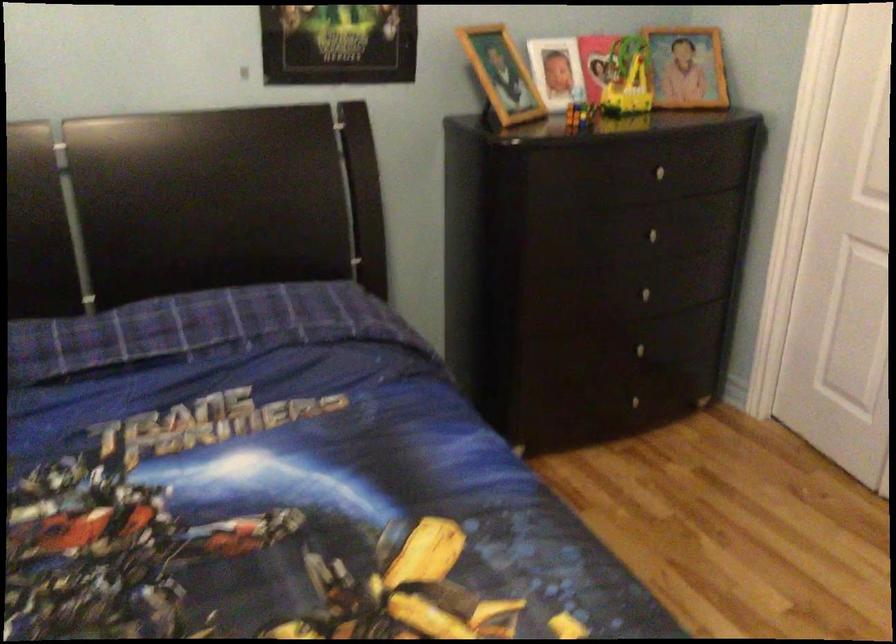
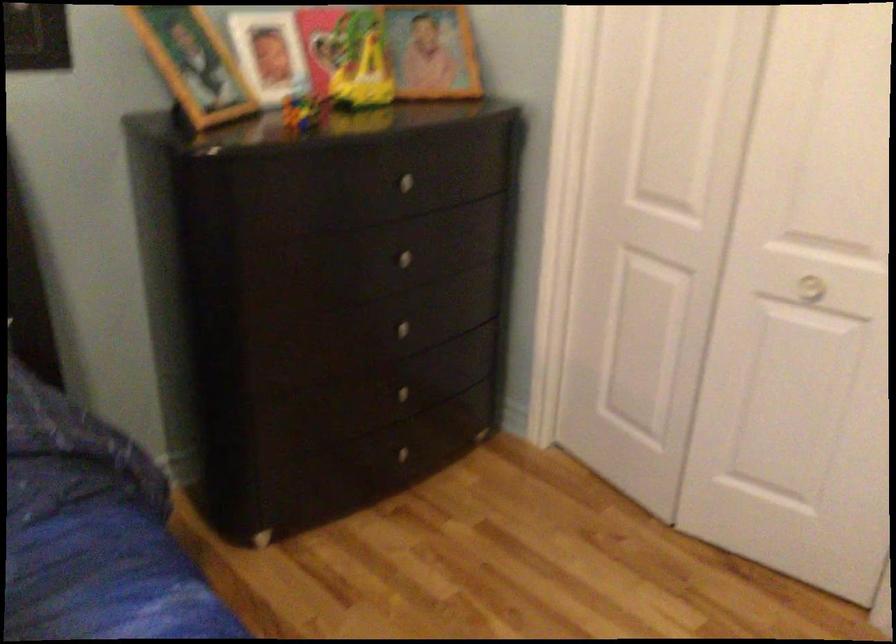
The point at (648, 232) is marked in the first image. Where is the corresponding point in the second image?

(399, 258)